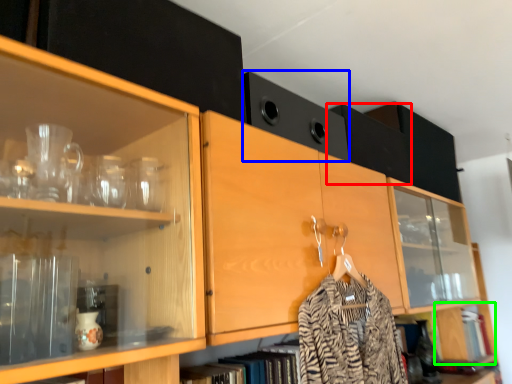
Question: Which object is positioned farthest from cabinetry (highlighted by a red box)? Select from cabinetry (highlighted by a blue box) and cabinetry (highlighted by a green box).

Choices:
 (A) cabinetry
 (B) cabinetry

Answer: (B)